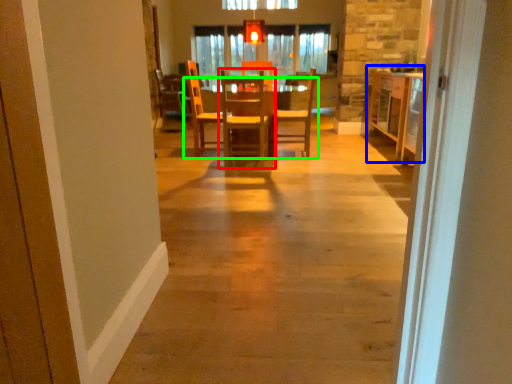
Question: Estimate the real-world distances between objects in this image. Which object is closer to chair (highlighted by a red box), table (highlighted by a blue box) or table (highlighted by a green box)?

Choices:
 (A) table
 (B) table

Answer: (B)